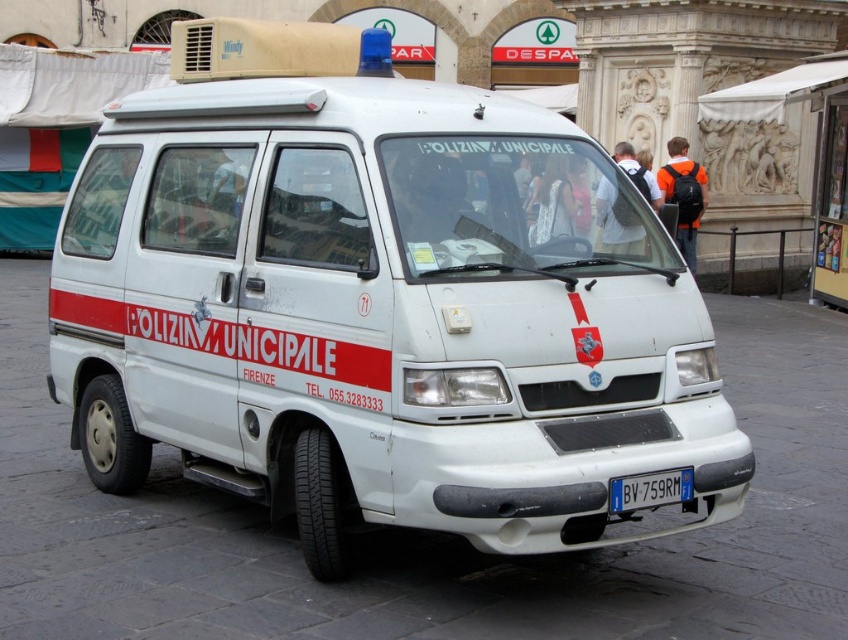
You are a delivery driver who needs to park your vehicle 4 feet away from the blue metallic license plate at front to comply with parking regulations. You are currently positioned at the white matte van at center. Can you park your vehicle legally?

The distance between the white matte van at center and the blue metallic license plate at front is 3.64 feet, which is less than the required 4 feet. Therefore, parking here would not comply with the regulations.

You are a delivery driver who needs to park your van in the same spot as the white matte van at center. The parking spot is marked by a point at coordinates (377, 301). Can you confirm if the parking spot is suitable for your van?

The point at coordinates (377, 301) corresponds to the white matte van at center, so yes, the parking spot is suitable for your van as it matches the location of the van in the image.